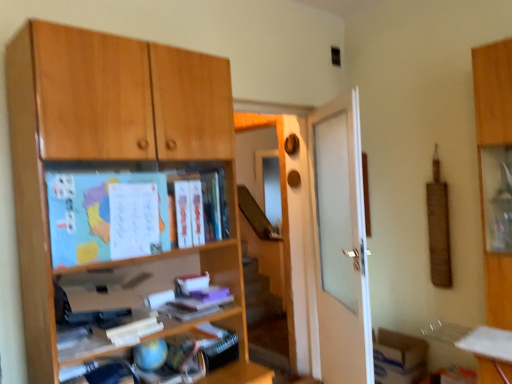
Question: Choose the correct answer: Is blue matte map at upper left inside transparent glass screen door at center or outside it?

Choices:
 (A) outside
 (B) inside

Answer: (A)

Question: From a real-world perspective, is blue matte map at upper left positioned above or below transparent glass screen door at center?

Choices:
 (A) below
 (B) above

Answer: (B)

Question: Estimate the real-world distances between objects in this image. Which object is farther from the matte paper book at center, the first book in the top-to-bottom sequence?

Choices:
 (A) white matte book at center, the second book positioned from the top
 (B) white matte door at center
 (C) blue matte map at upper left
 (D) transparent glass screen door at center

Answer: (D)

Question: Which object is the farthest from the white matte door at center?

Choices:
 (A) matte paper book at center, the first book in the top-to-bottom sequence
 (B) blue matte map at upper left
 (C) white matte book at center, the second book positioned from the top
 (D) transparent glass screen door at center

Answer: (B)